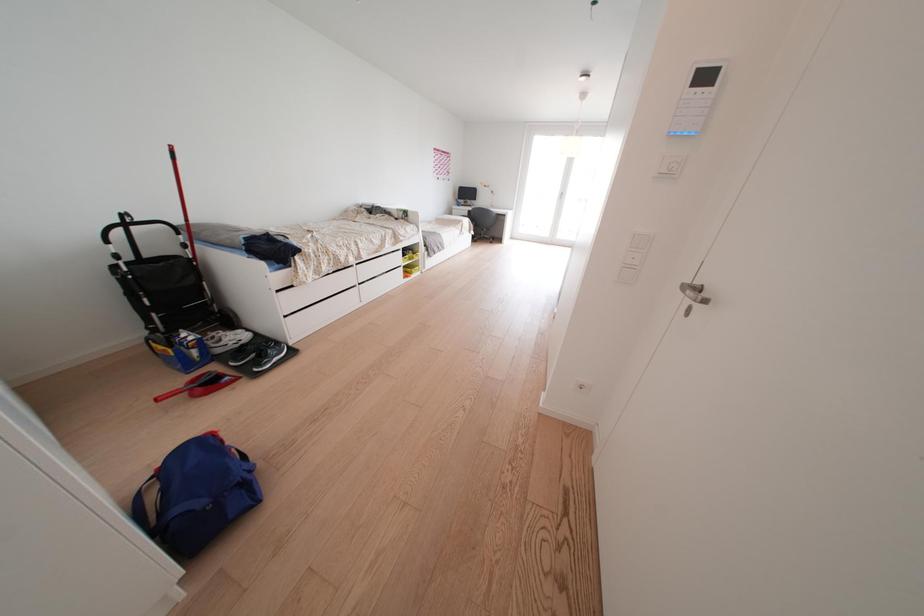
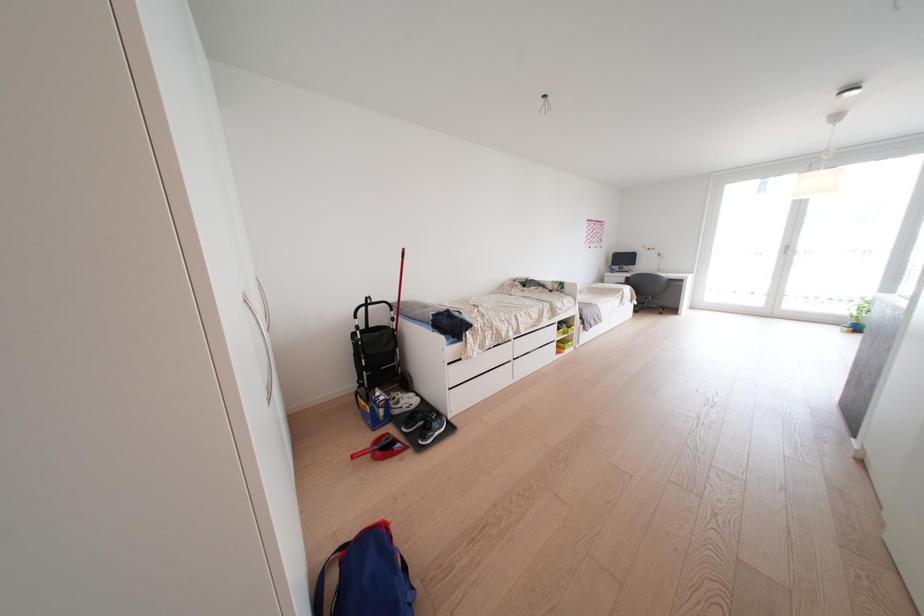
Question: The camera is either moving clockwise (left) or counter-clockwise (right) around the object. The first image is from the beginning of the video and the second image is from the end. Is the camera moving left or right when shooting the video?

Choices:
 (A) Left
 (B) Right

Answer: (B)